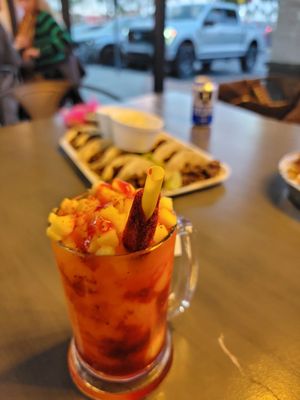
Find the location of a particular element. The image size is (300, 400). glass mug is located at coordinates (148, 281).